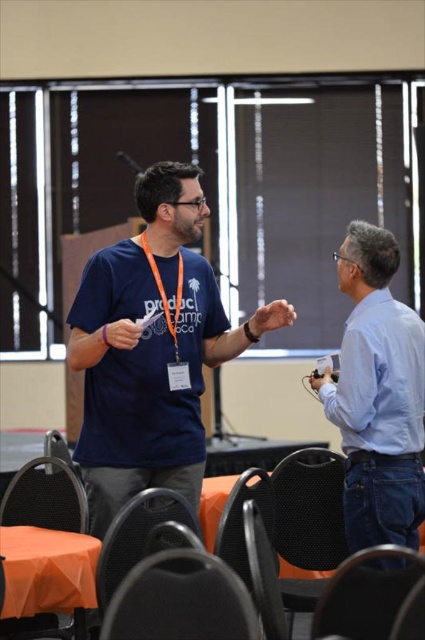
The height and width of the screenshot is (640, 425). Find the location of `matte blue t-shirt at center`. matte blue t-shirt at center is located at coordinates [152, 348].

Between matte blue t-shirt at center and orange fabric table at lower left, which one appears on the right side from the viewer's perspective?

Positioned to the right is matte blue t-shirt at center.

The height and width of the screenshot is (640, 425). What are the coordinates of `matte blue t-shirt at center` in the screenshot? It's located at (152, 348).

I want to click on matte blue t-shirt at center, so click(x=152, y=348).

Looking at this image, who is higher up, transparent glass projection screen at upper center or orange fabric table at lower left?

transparent glass projection screen at upper center

Is transparent glass projection screen at upper center bigger than orange fabric table at lower left?

Correct, transparent glass projection screen at upper center is larger in size than orange fabric table at lower left.

Measure the distance between transparent glass projection screen at upper center and camera.

transparent glass projection screen at upper center and camera are 6.94 meters apart.

Where is `transparent glass projection screen at upper center`? The height and width of the screenshot is (640, 425). transparent glass projection screen at upper center is located at coordinates (221, 180).

Does matte blue t-shirt at center have a larger size compared to light blue shirt at right?

Yes, matte blue t-shirt at center is bigger than light blue shirt at right.

Measure the distance between matte blue t-shirt at center and camera.

matte blue t-shirt at center and camera are 9.31 feet apart from each other.

Locate an element on the screen. The height and width of the screenshot is (640, 425). matte blue t-shirt at center is located at coordinates (152, 348).

At what (x,y) coordinates should I click in order to perform the action: click on matte blue t-shirt at center. Please return your answer as a coordinate pair (x, y). Image resolution: width=425 pixels, height=640 pixels. Looking at the image, I should click on (152, 348).